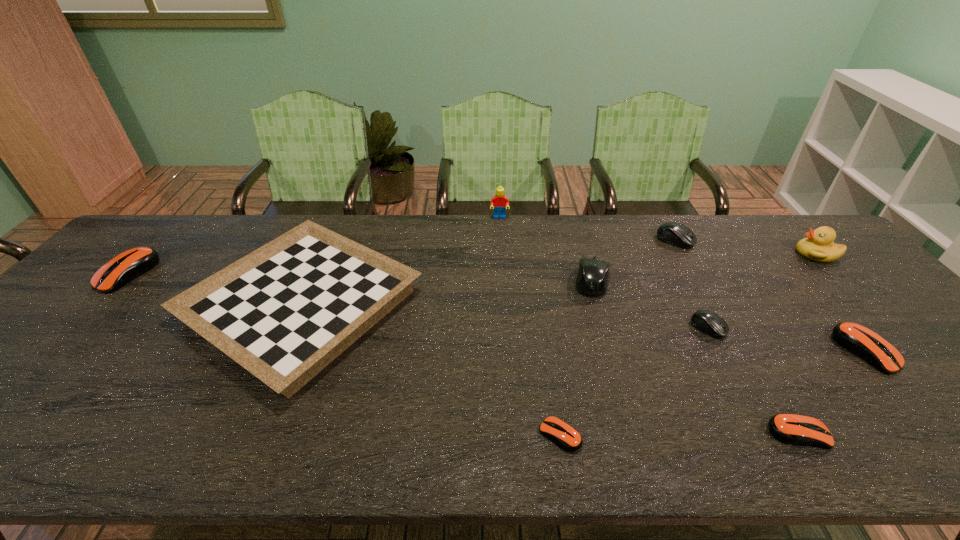
Where is `vacant space that satisfies the following two spatial constraints: 1. on the face of the tallest object; 2. on the left side of the ninth tallest object`? This screenshot has width=960, height=540. vacant space that satisfies the following two spatial constraints: 1. on the face of the tallest object; 2. on the left side of the ninth tallest object is located at coordinates (512, 434).

The height and width of the screenshot is (540, 960). I want to click on vacant region that satisfies the following two spatial constraints: 1. on the front side of the biggest black mouse; 2. on the right side of the leftmost orange computer mouse, so click(121, 280).

Find the location of a particular element. This screenshot has width=960, height=540. vacant space that satisfies the following two spatial constraints: 1. on the face of the Lego; 2. on the right side of the second shortest object is located at coordinates pos(512,434).

At what (x,y) coordinates should I click in order to perform the action: click on vacant region that satisfies the following two spatial constraints: 1. on the face of the rightmost computer mouse; 2. on the right side of the red Lego. Please return your answer as a coordinate pair (x, y). The width and height of the screenshot is (960, 540). Looking at the image, I should click on (507, 350).